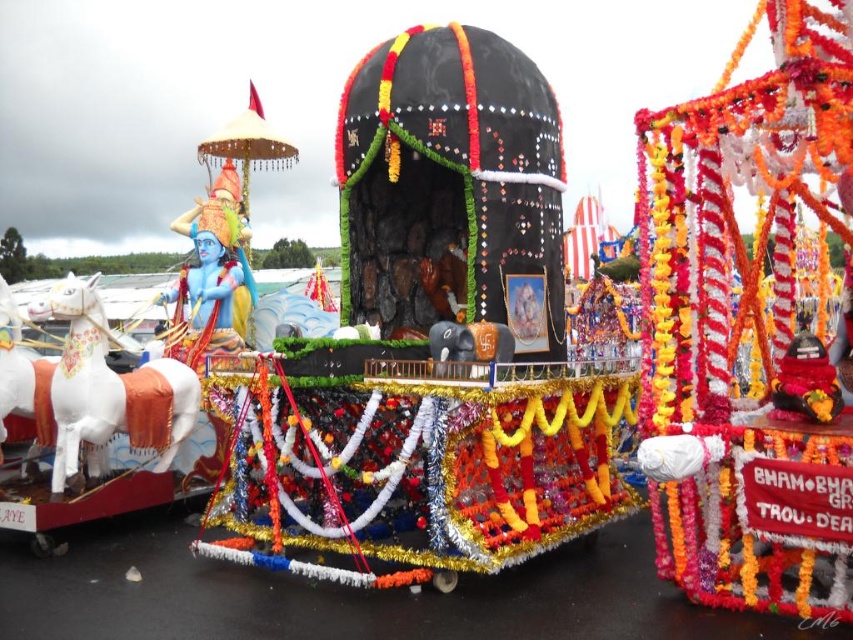
You are designing a parade route and need to ensure that the white glossy horse at left and the blue painted statue at left can pass through a narrow alleyway. Based on their widths, which one is more likely to fit through the alleyway without adjustments?

The blue painted statue at left is narrower than the white glossy horse at left, so the blue painted statue at left is more likely to fit through the narrow alleyway without adjustments.

You are standing in front of the float and want to determine the relative positions of two points marked on it. Which point is closer to you, point (231, 342) or point (837, 381)?

Point (231, 342) is closer to you than point (837, 381) because it is further to the viewer according to the description.